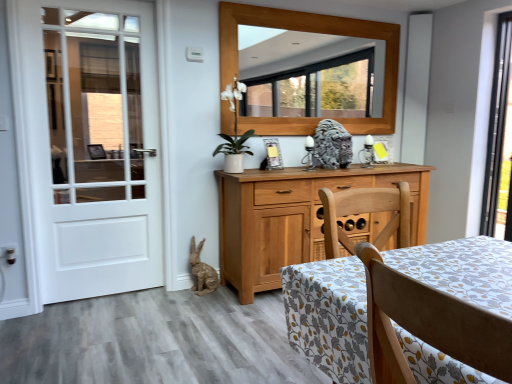
Question: Considering the relative sizes of burlap-textured rabbit at lower left, which is counted as the 2th animal, starting from the right, and light brown wood chair at lower right in the image provided, is burlap-textured rabbit at lower left, which is counted as the 2th animal, starting from the right, smaller than light brown wood chair at lower right?

Choices:
 (A) no
 (B) yes

Answer: (B)

Question: Is burlap-textured rabbit at lower left, which is counted as the 2th animal, starting from the right, behind light brown wood chair at lower right?

Choices:
 (A) no
 (B) yes

Answer: (B)

Question: Is burlap-textured rabbit at lower left, the 2th animal viewed from the top, far from light brown wood chair at lower right?

Choices:
 (A) no
 (B) yes

Answer: (B)

Question: Can light brown wood chair at lower right be found inside burlap-textured rabbit at lower left, the 2th animal viewed from the top?

Choices:
 (A) no
 (B) yes

Answer: (A)

Question: From a real-world perspective, is burlap-textured rabbit at lower left, which is counted as the 2th animal, starting from the right, below light brown wood chair at lower right?

Choices:
 (A) no
 (B) yes

Answer: (B)

Question: Is burlap-textured rabbit at lower left, the 2th animal viewed from the top, directly adjacent to light brown wood chair at lower right?

Choices:
 (A) yes
 (B) no

Answer: (B)

Question: Is matte wooden picture frame at center facing towards gray stone lion at center, the second animal when ordered from left to right?

Choices:
 (A) yes
 (B) no

Answer: (B)

Question: From the image's perspective, is matte wooden picture frame at center below gray stone lion at center, positioned as the 2th animal in bottom-to-top order?

Choices:
 (A) no
 (B) yes

Answer: (B)

Question: Is matte wooden picture frame at center shorter than gray stone lion at center, the 1th animal positioned from the right?

Choices:
 (A) no
 (B) yes

Answer: (B)

Question: Is the depth of matte wooden picture frame at center less than that of gray stone lion at center, the first animal from the top?

Choices:
 (A) no
 (B) yes

Answer: (A)

Question: Considering the relative positions of matte wooden picture frame at center and gray stone lion at center, the 1th animal positioned from the right, in the image provided, is matte wooden picture frame at center to the right of gray stone lion at center, the 1th animal positioned from the right, from the viewer's perspective?

Choices:
 (A) yes
 (B) no

Answer: (B)

Question: Is matte wooden picture frame at center far away from gray stone lion at center, the first animal from the top?

Choices:
 (A) no
 (B) yes

Answer: (A)

Question: Can you confirm if burlap-textured rabbit at lower left, which is counted as the 2th animal, starting from the right, is bigger than matte wooden picture frame at center?

Choices:
 (A) yes
 (B) no

Answer: (A)